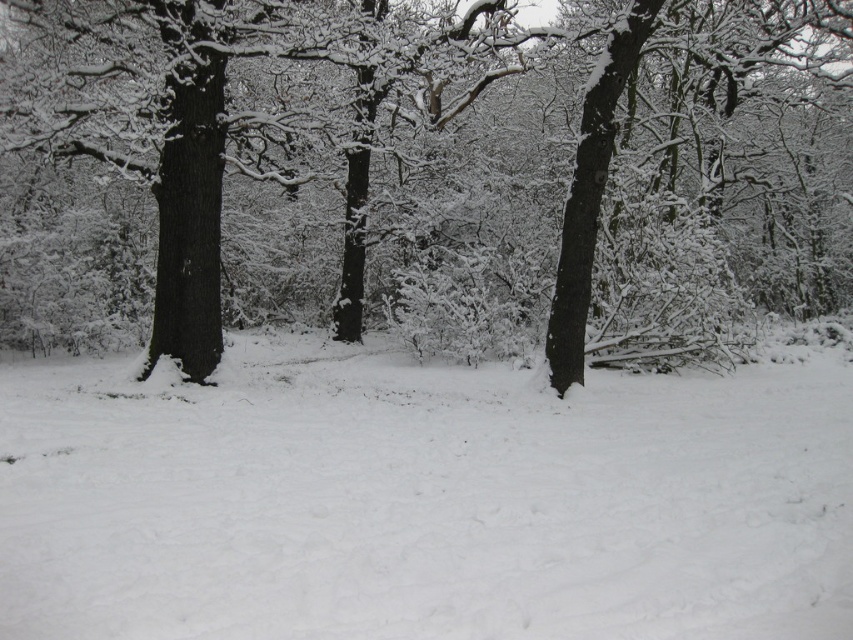
You are standing in a snowy forest and want to reach a specific point marked as point (521, 99). If your walking speed is 1.5 meters per second, how long will it take you to reach that point?

The distance between point (521, 99) and the viewer is 31.36 meters. At a walking speed of 1.5 meters per second, it would take approximately 20.9 seconds to reach the point.

You are an animal trying to cross the forest floor. You see the smooth bark tree at center and the white fluffy snow at center. Which one is wider?

The smooth bark tree at center is wider than the white fluffy snow at center.

In the winter forest scene, there is a smooth bark tree at center and white fluffy snow at center. Which object takes up more space in the image?

The smooth bark tree at center has a larger size compared to the white fluffy snow at center, so it takes up more space in the image.